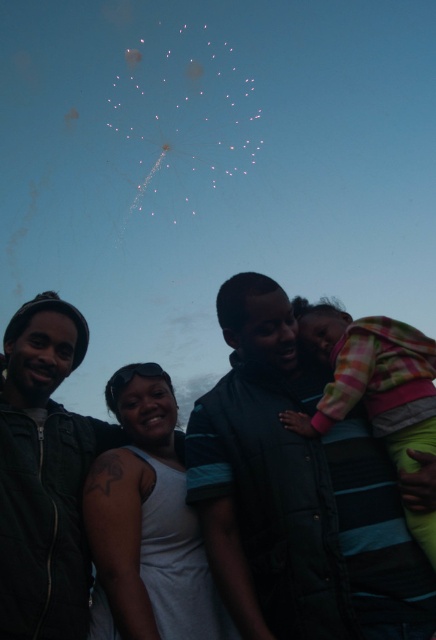
Consider the image. Between matte black jacket at center and dark green jacket at left, which one is positioned lower?

matte black jacket at center is below.

Measure the distance between matte black jacket at center and camera.

The distance of matte black jacket at center from camera is 20.92 feet.

Between point (279, 310) and point (30, 465), which one is positioned behind?

The point (279, 310) is more distant.

Locate an element on the screen. matte black jacket at center is located at coordinates (299, 492).

Is point (309, 548) closer to camera compared to point (313, 317)?

Yes.

This screenshot has height=640, width=436. Identify the location of matte black jacket at center. [299, 492].

The width and height of the screenshot is (436, 640). Describe the element at coordinates (299, 492) in the screenshot. I see `matte black jacket at center` at that location.

Where is `matte black jacket at center`? The image size is (436, 640). matte black jacket at center is located at coordinates (299, 492).

Is dark green jacket at left bigger than plaid fleece jacket at center?

Actually, dark green jacket at left might be smaller than plaid fleece jacket at center.

The image size is (436, 640). What do you see at coordinates (44, 476) in the screenshot?
I see `dark green jacket at left` at bounding box center [44, 476].

The height and width of the screenshot is (640, 436). What are the coordinates of `dark green jacket at left` in the screenshot? It's located at (44, 476).